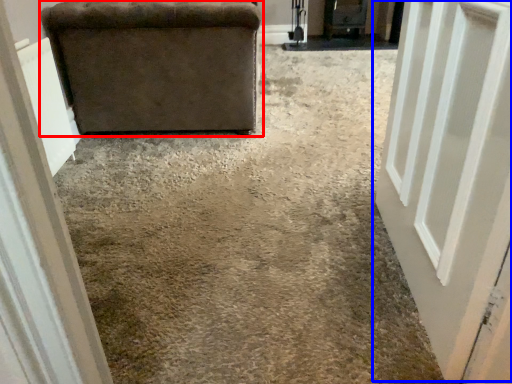
Question: Which object appears closest to the camera in this image, furniture (highlighted by a red box) or door (highlighted by a blue box)?

Choices:
 (A) furniture
 (B) door

Answer: (B)